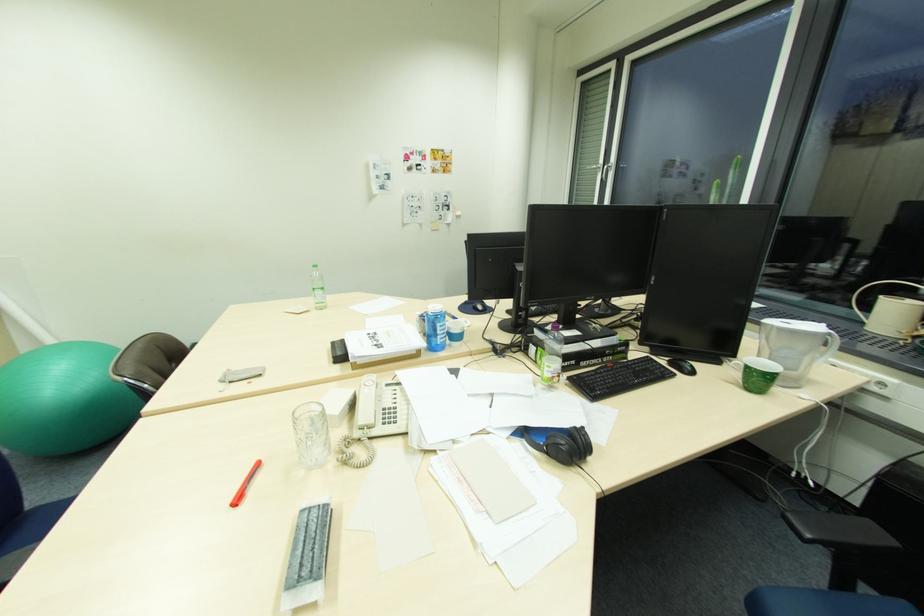
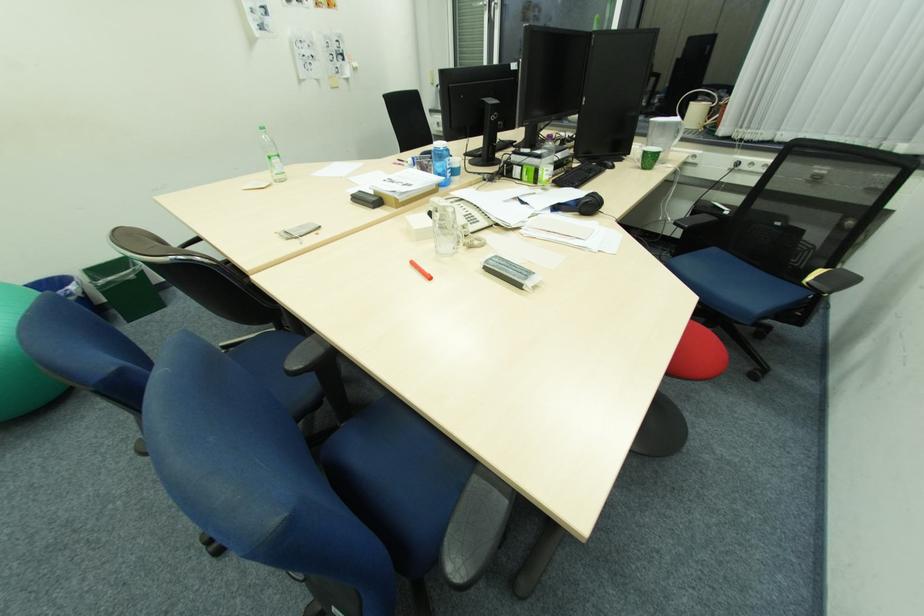
Where in the second image is the point corresponding to (322,293) from the first image?

(280, 161)